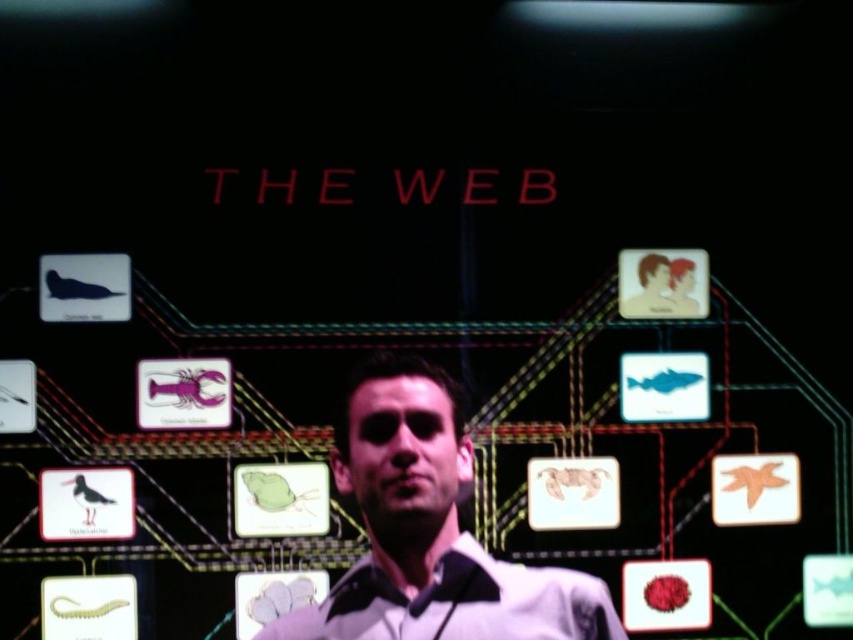
You are a fashion designer observing two shirts in the image. The white matte shirt at center and the white glossy dress shirt at center. Which one is positioned higher?

The white matte shirt at center is above the white glossy dress shirt at center, so the white matte shirt at center is positioned higher.

You are a photographer trying to capture the man in the image. You notice two shirts on him, the white matte shirt at center and the white glossy dress shirt at center. Which shirt will appear more prominent in your photo due to its position?

The white matte shirt at center is closer to the viewer than the white glossy dress shirt at center, so it will appear more prominent in the photo.